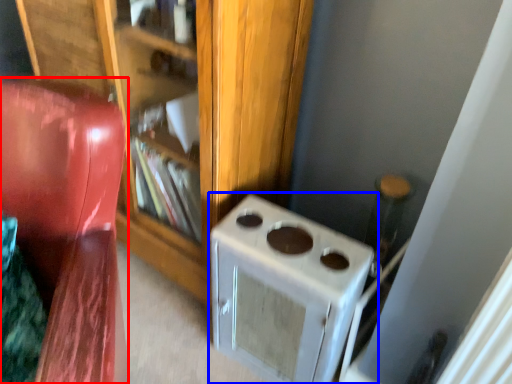
Question: Which of the following is the closest to the observer, furniture (highlighted by a red box) or home appliance (highlighted by a blue box)?

Choices:
 (A) furniture
 (B) home appliance

Answer: (A)